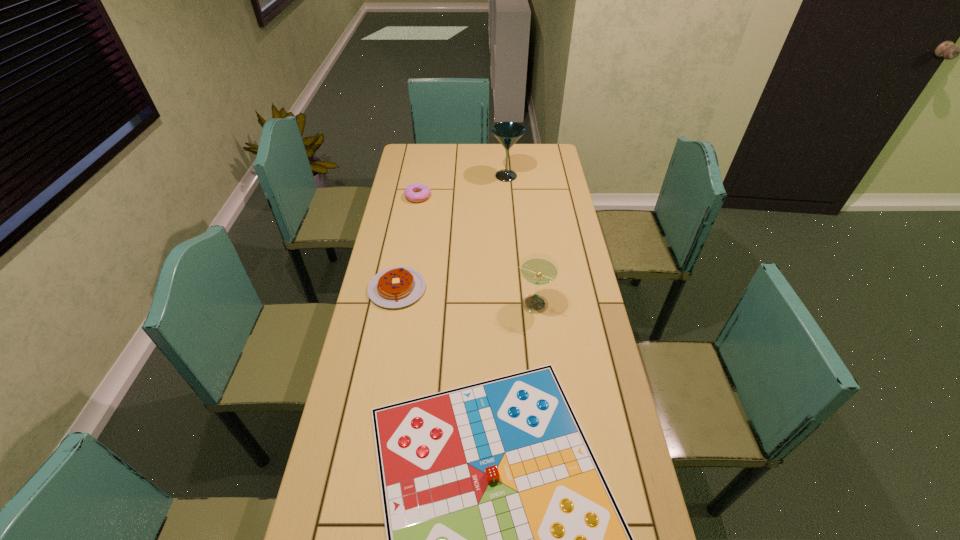
In order to click on unoccupied position between the doughnut and the tallest object in this screenshot , I will do `click(462, 186)`.

This screenshot has height=540, width=960. In order to click on blank region between the second tallest object and the doughnut in this screenshot , I will do `click(475, 251)`.

Image resolution: width=960 pixels, height=540 pixels. In order to click on free space between the pancake and the fourth nearest object in this screenshot , I will do `click(408, 242)`.

Identify the location of vacant region between the shorter martini and the pancake. The height and width of the screenshot is (540, 960). (465, 296).

What are the coordinates of `vacant area between the fourth shortest object and the tallest object` in the screenshot? It's located at (519, 240).

Where is `the second closest object to the taller martini`? The height and width of the screenshot is (540, 960). the second closest object to the taller martini is located at coordinates (394, 287).

This screenshot has width=960, height=540. Identify the location of object that is the closest to the pancake. (504, 539).

I want to click on free space that satisfies the following two spatial constraints: 1. on the front side of the fourth nearest object; 2. on the left side of the nearer martini, so click(x=399, y=304).